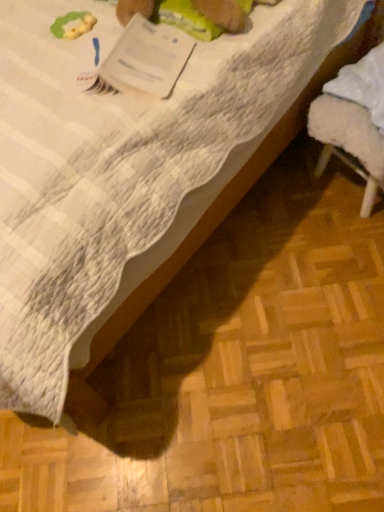
Question: Looking at their shapes, would you say white fluffy stool at lower right is wider or thinner than white paper at upper left?

Choices:
 (A) thin
 (B) wide

Answer: (A)

Question: In terms of size, does white fluffy stool at lower right appear bigger or smaller than white paper at upper left?

Choices:
 (A) big
 (B) small

Answer: (A)

Question: Considering their positions, is white fluffy stool at lower right located in front of or behind white paper at upper left?

Choices:
 (A) behind
 (B) front

Answer: (A)

Question: From the image's perspective, is white paper at upper left located above or below white fluffy stool at lower right?

Choices:
 (A) above
 (B) below

Answer: (A)

Question: Is white paper at upper left taller or shorter than white fluffy stool at lower right?

Choices:
 (A) tall
 (B) short

Answer: (B)

Question: Is white paper at upper left inside or outside of white fluffy stool at lower right?

Choices:
 (A) outside
 (B) inside

Answer: (A)

Question: Is point (x=155, y=67) closer or farther from the camera than point (x=339, y=112)?

Choices:
 (A) closer
 (B) farther

Answer: (A)